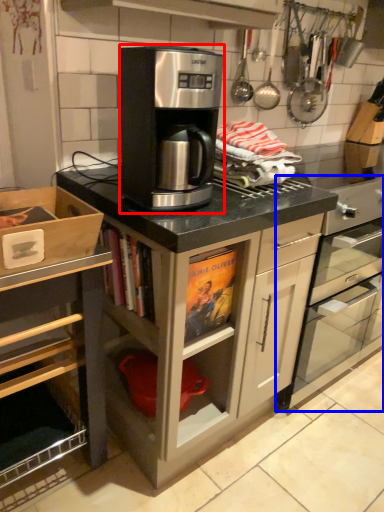
Question: Which point is further to the camera, kitchen appliance (highlighted by a red box) or home appliance (highlighted by a blue box)?

Choices:
 (A) kitchen appliance
 (B) home appliance

Answer: (B)